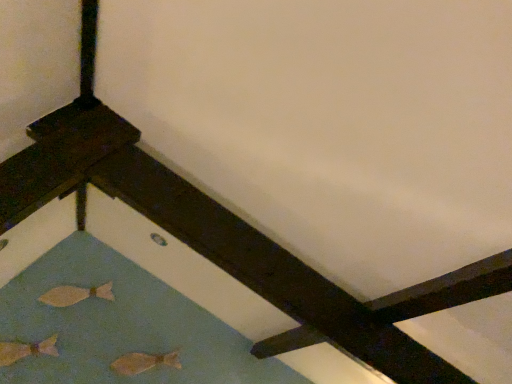
In order to face matte beige fish at lower left, positioned as the first fish in bottom-to-top order, should I rotate leftwards or rightwards?

It's best to rotate left around 14.267 degrees.

Measure the distance between matte beige fish at lower left, acting as the third fish starting from the bottom, and camera.

matte beige fish at lower left, acting as the third fish starting from the bottom, is 7.76 feet from camera.

In order to face matte beige fish at lower left, which is the first fish from top to bottom, should I rotate leftwards or rightwards?

Rotate your view left by about 22.556°.

Where is `matte beige fish at lower left, the 1th fish viewed from the right`? The width and height of the screenshot is (512, 384). matte beige fish at lower left, the 1th fish viewed from the right is located at coordinates (144, 362).

From the image's perspective, between matte beige fish at lower left, acting as the third fish starting from the bottom, and matte beige fish at lower left, which is the third fish in left-to-right order, who is located below?

From the image's view, matte beige fish at lower left, which is the third fish in left-to-right order, is below.

Considering the positions of point (98, 287) and point (139, 355), is point (98, 287) closer or farther from the camera than point (139, 355)?

Point (98, 287) is positioned farther from the camera compared to point (139, 355).

Is matte beige fish at lower left, acting as the third fish starting from the bottom, inside the boundaries of matte beige fish at lower left, which is the third fish in left-to-right order, or outside?

matte beige fish at lower left, acting as the third fish starting from the bottom, is located beyond the bounds of matte beige fish at lower left, which is the third fish in left-to-right order.

Is the depth of matte beige fish at lower left, which ranks as the 2th fish in left-to-right order, less than that of matte beige fish at lower left, positioned as the first fish in bottom-to-top order?

No.

Is matte gold fish at lower left, positioned as the 3th fish in right-to-left order, facing towards matte beige fish at lower left, which is the first fish from top to bottom?

No, matte gold fish at lower left, positioned as the 3th fish in right-to-left order, does not turn towards matte beige fish at lower left, which is the first fish from top to bottom.

From a real-world perspective, which is physically above, matte gold fish at lower left, the second fish from the top, or matte beige fish at lower left, which ranks as the 2th fish in left-to-right order?

In real-world perspective, matte beige fish at lower left, which ranks as the 2th fish in left-to-right order, is above.

Looking at this image, is matte gold fish at lower left, positioned as the 3th fish in right-to-left order, next to matte beige fish at lower left, which is the first fish from top to bottom, and touching it?

No.

From the image's perspective, which fish is the 1st one below the matte beige fish at lower left, which ranks as the 2th fish in left-to-right order? Please provide its 2D coordinates.

[(26, 350)]

What's the angular difference between matte gold fish at lower left, the second fish from the top, and matte beige fish at lower left, positioned as the first fish in bottom-to-top order,'s facing directions?

The facing directions of matte gold fish at lower left, the second fish from the top, and matte beige fish at lower left, positioned as the first fish in bottom-to-top order, are 0.76 degrees apart.

Is matte beige fish at lower left, which is the third fish in left-to-right order, located within matte gold fish at lower left, acting as the 2th fish starting from the bottom?

No, matte beige fish at lower left, which is the third fish in left-to-right order, is located outside of matte gold fish at lower left, acting as the 2th fish starting from the bottom.

Is matte gold fish at lower left, positioned as the 3th fish in right-to-left order, bigger than matte beige fish at lower left, the 1th fish viewed from the right?

A: Indeed, matte gold fish at lower left, positioned as the 3th fish in right-to-left order, has a larger size compared to matte beige fish at lower left, the 1th fish viewed from the right.

Does matte gold fish at lower left, acting as the 2th fish starting from the bottom, turn towards matte beige fish at lower left, which is the third fish in left-to-right order?

No.

Considering the sizes of objects matte beige fish at lower left, which is the 3th fish from top to bottom, and matte beige fish at lower left, the 2th fish viewed from the right, in the image provided, who is shorter, matte beige fish at lower left, which is the 3th fish from top to bottom, or matte beige fish at lower left, the 2th fish viewed from the right,?

Standing shorter between the two is matte beige fish at lower left, the 2th fish viewed from the right.

Starting from the matte beige fish at lower left, the 2th fish viewed from the right, which fish is the 1st one in front? Please provide its 2D coordinates.

[(144, 362)]

Consider the image. From a real-world perspective, is matte beige fish at lower left, which is the 3th fish from top to bottom, below matte beige fish at lower left, which ranks as the 2th fish in left-to-right order?

Indeed, from a real-world perspective, matte beige fish at lower left, which is the 3th fish from top to bottom, is positioned beneath matte beige fish at lower left, which ranks as the 2th fish in left-to-right order.

Is matte beige fish at lower left, which is the 3th fish from top to bottom, facing away from matte beige fish at lower left, the 2th fish viewed from the right?

That's not correct — matte beige fish at lower left, which is the 3th fish from top to bottom, is not looking away from matte beige fish at lower left, the 2th fish viewed from the right.

Which is in front, matte beige fish at lower left, which is the 3th fish from top to bottom, or matte gold fish at lower left, which ranks as the 1th fish in left-to-right order?

matte gold fish at lower left, which ranks as the 1th fish in left-to-right order.

You are a GUI agent. You are given a task and a screenshot of the screen. Output one action in this format:
    pyautogui.click(x=<x>, y=<y>)
    Task: Click on the 2nd fish counting from the right side of the matte gold fish at lower left, the second fish from the top
    The image size is (512, 384).
    Given the screenshot: What is the action you would take?
    pyautogui.click(x=144, y=362)

From a real-world perspective, who is located lower, matte beige fish at lower left, the 1th fish viewed from the right, or matte gold fish at lower left, acting as the 2th fish starting from the bottom?

In real-world perspective, matte beige fish at lower left, the 1th fish viewed from the right, is lower.

Is matte beige fish at lower left, positioned as the first fish in bottom-to-top order, positioned with its back to matte gold fish at lower left, acting as the 2th fish starting from the bottom?

No, matte beige fish at lower left, positioned as the first fish in bottom-to-top order, is not facing the opposite direction of matte gold fish at lower left, acting as the 2th fish starting from the bottom.

Consider the image. From the image's perspective, relative to matte gold fish at lower left, which ranks as the 1th fish in left-to-right order, is matte beige fish at lower left, the 2th fish viewed from the right, above or below?

From the image's perspective, matte beige fish at lower left, the 2th fish viewed from the right, appears above matte gold fish at lower left, which ranks as the 1th fish in left-to-right order.

From the picture: Is matte beige fish at lower left, the 2th fish viewed from the right, in front of or behind matte gold fish at lower left, acting as the 2th fish starting from the bottom, in the image?

matte beige fish at lower left, the 2th fish viewed from the right, is positioned farther from the viewer than matte gold fish at lower left, acting as the 2th fish starting from the bottom.

Looking at this image, can you confirm if matte beige fish at lower left, the 2th fish viewed from the right, is thinner than matte gold fish at lower left, which ranks as the 1th fish in left-to-right order?

Yes, matte beige fish at lower left, the 2th fish viewed from the right, is thinner than matte gold fish at lower left, which ranks as the 1th fish in left-to-right order.

What's the angular difference between matte beige fish at lower left, which is the first fish from top to bottom, and matte gold fish at lower left, the second fish from the top,'s facing directions?

0.227 degrees.

Find the location of a particular element. Image resolution: width=512 pixels, height=384 pixels. fish behind the matte beige fish at lower left, which is the third fish in left-to-right order is located at coordinates (75, 295).

From the matte beige fish at lower left, which is the first fish from top to bottom, count 2nd fishs forward and point to it. Please provide its 2D coordinates.

[(26, 350)]

Based on their spatial positions, is matte beige fish at lower left, which is the 3th fish from top to bottom, or matte gold fish at lower left, acting as the 2th fish starting from the bottom, closer to matte beige fish at lower left, the 2th fish viewed from the right?

The object closer to matte beige fish at lower left, the 2th fish viewed from the right, is matte gold fish at lower left, acting as the 2th fish starting from the bottom.

Based on their spatial positions, is matte beige fish at lower left, which ranks as the 2th fish in left-to-right order, or matte beige fish at lower left, which is the 3th fish from top to bottom, closer to matte gold fish at lower left, the second fish from the top?

Based on the image, matte beige fish at lower left, which ranks as the 2th fish in left-to-right order, appears to be nearer to matte gold fish at lower left, the second fish from the top.

In the scene shown: Estimate the real-world distances between objects in this image. Which object is closer to matte gold fish at lower left, which ranks as the 1th fish in left-to-right order, matte beige fish at lower left, positioned as the first fish in bottom-to-top order, or matte beige fish at lower left, acting as the third fish starting from the bottom?

matte beige fish at lower left, acting as the third fish starting from the bottom, is positioned closer to the anchor matte gold fish at lower left, which ranks as the 1th fish in left-to-right order.

Estimate the real-world distances between objects in this image. Which object is further from matte beige fish at lower left, acting as the third fish starting from the bottom, matte gold fish at lower left, positioned as the 3th fish in right-to-left order, or matte beige fish at lower left, positioned as the first fish in bottom-to-top order?

matte beige fish at lower left, positioned as the first fish in bottom-to-top order, is further to matte beige fish at lower left, acting as the third fish starting from the bottom.

Which object lies nearer to the anchor point matte beige fish at lower left, the 1th fish viewed from the right, matte beige fish at lower left, the 2th fish viewed from the right, or matte gold fish at lower left, positioned as the 3th fish in right-to-left order?

The object closer to matte beige fish at lower left, the 1th fish viewed from the right, is matte beige fish at lower left, the 2th fish viewed from the right.

Considering their positions, is matte gold fish at lower left, acting as the 2th fish starting from the bottom, positioned further to matte beige fish at lower left, which is the 3th fish from top to bottom, than matte beige fish at lower left, the 2th fish viewed from the right?

matte gold fish at lower left, acting as the 2th fish starting from the bottom, is further to matte beige fish at lower left, which is the 3th fish from top to bottom.

This screenshot has width=512, height=384. Identify the location of fish situated between matte gold fish at lower left, the second fish from the top, and matte beige fish at lower left, which is the 3th fish from top to bottom, from left to right. 75,295.